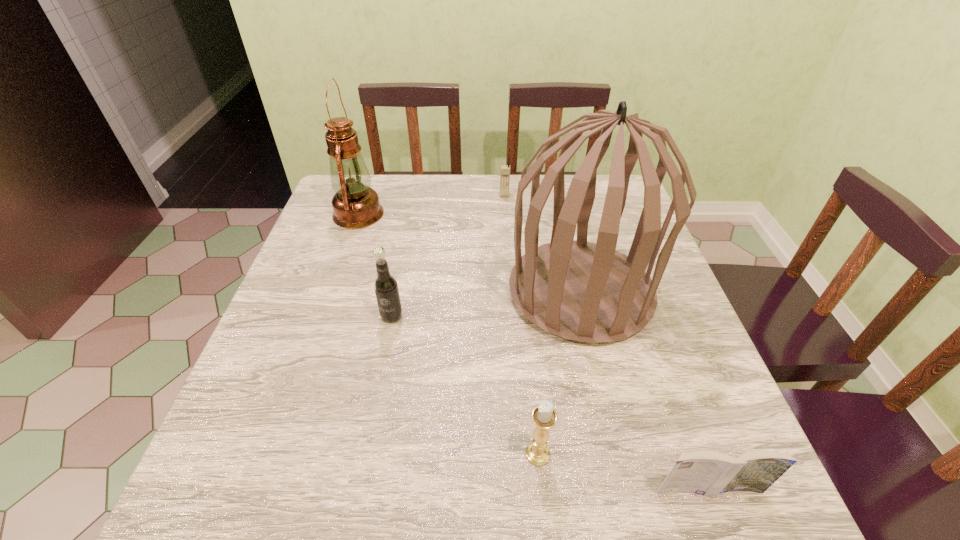
This screenshot has width=960, height=540. In order to click on birdcage in this screenshot , I will do `click(589, 292)`.

Locate an element on the screen. The image size is (960, 540). the fifth shortest object is located at coordinates (355, 205).

At what (x,y) coordinates should I click in order to perform the action: click on oil lamp. Please return your answer as a coordinate pair (x, y). This screenshot has width=960, height=540. Looking at the image, I should click on (355, 205).

Image resolution: width=960 pixels, height=540 pixels. In order to click on root beer in this screenshot , I will do pos(385,285).

I want to click on the fifth object from right to left, so click(385, 285).

Locate an element on the screen. The width and height of the screenshot is (960, 540). cellular telephone is located at coordinates (505, 169).

Image resolution: width=960 pixels, height=540 pixels. Find the location of `the fifth farthest object`. the fifth farthest object is located at coordinates (544, 417).

At what (x,y) coordinates should I click in order to perform the action: click on book. Please return your answer as a coordinate pair (x, y). The height and width of the screenshot is (540, 960). Looking at the image, I should click on (708, 473).

Locate an element on the screen. the shortest object is located at coordinates (x=708, y=473).

At what (x,y) coordinates should I click in order to perform the action: click on vacant space located 0.130m on the front of the birdcage. Please return your answer as a coordinate pair (x, y). This screenshot has width=960, height=540. Looking at the image, I should click on (608, 405).